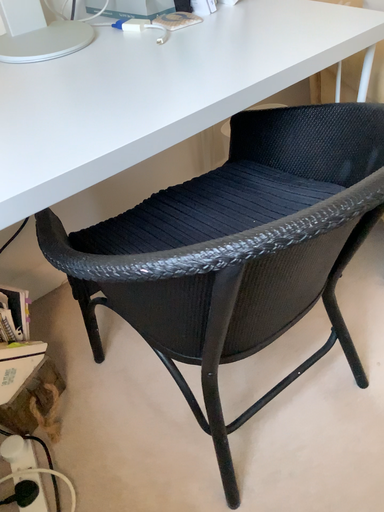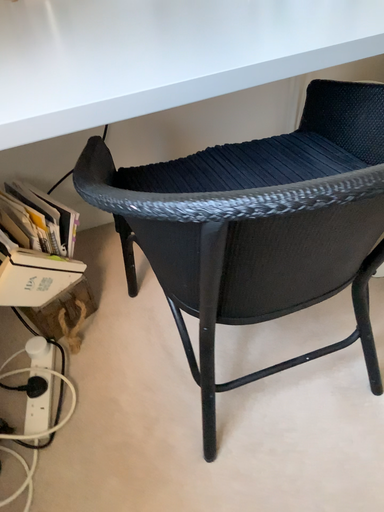
Question: Which way did the camera rotate in the video?

Choices:
 (A) rotated right
 (B) rotated left

Answer: (B)